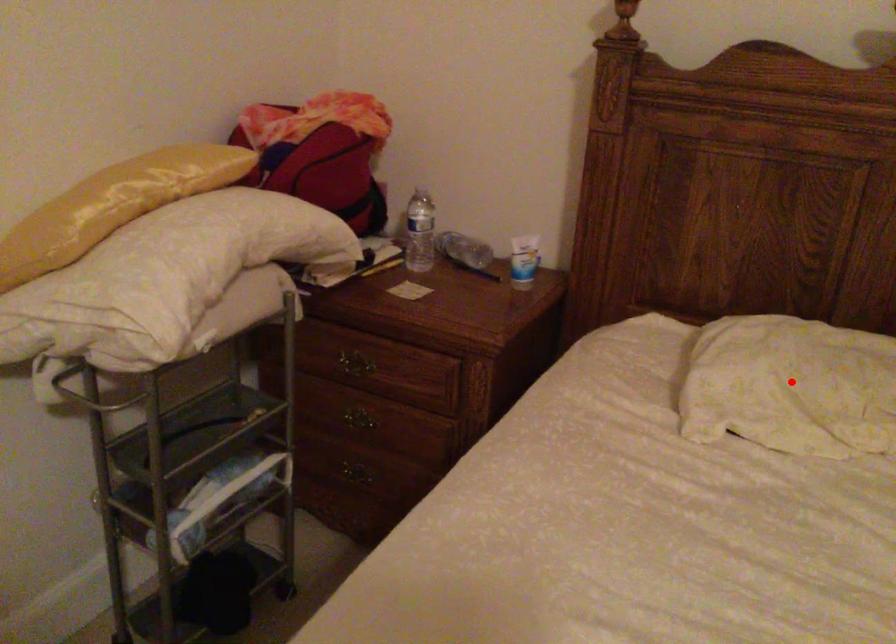
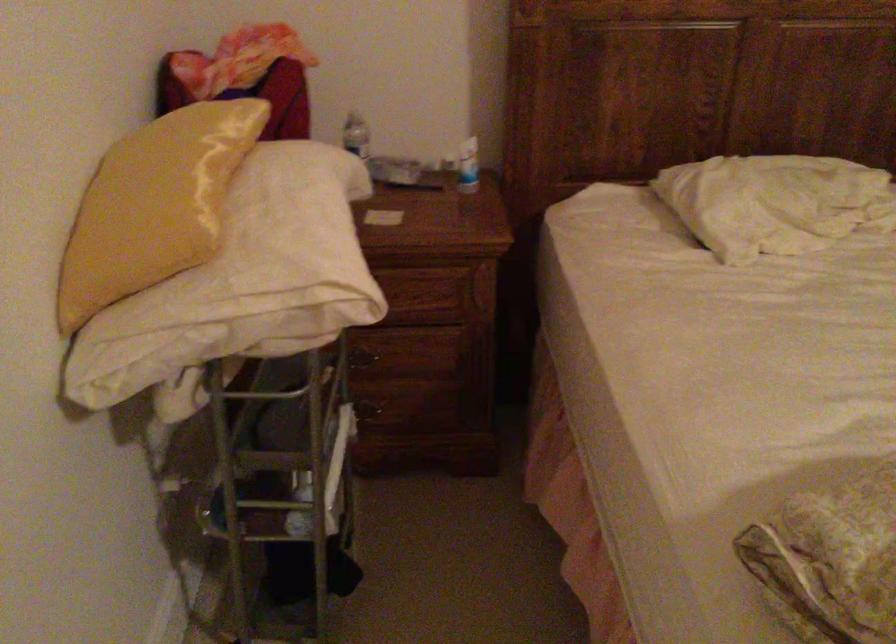
Question: I am providing you with two images of the same scene from different viewpoints. In image1, a red point is highlighted. Considering the same 3D point in image2, which of the following is correct?

Choices:
 (A) It is closer
 (B) It is farther

Answer: (B)